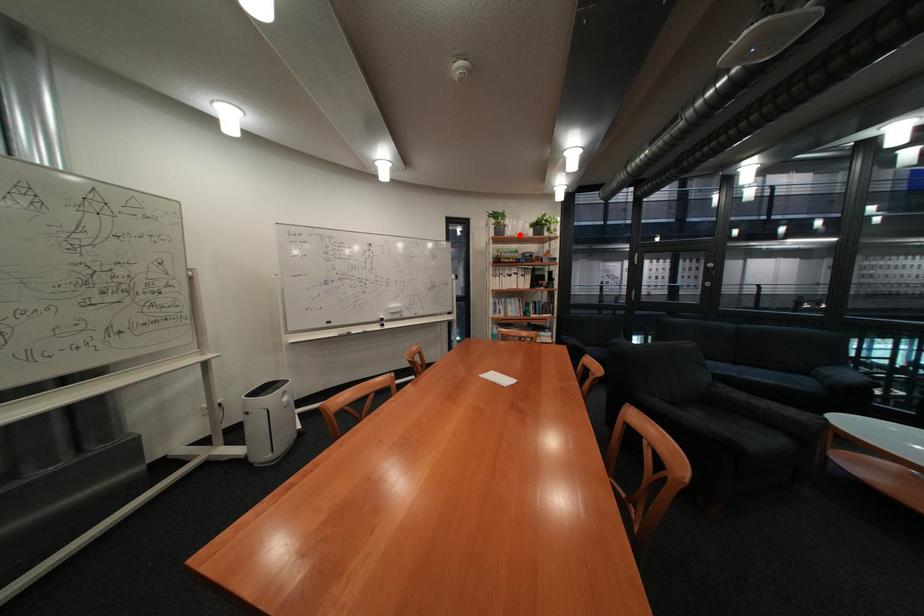
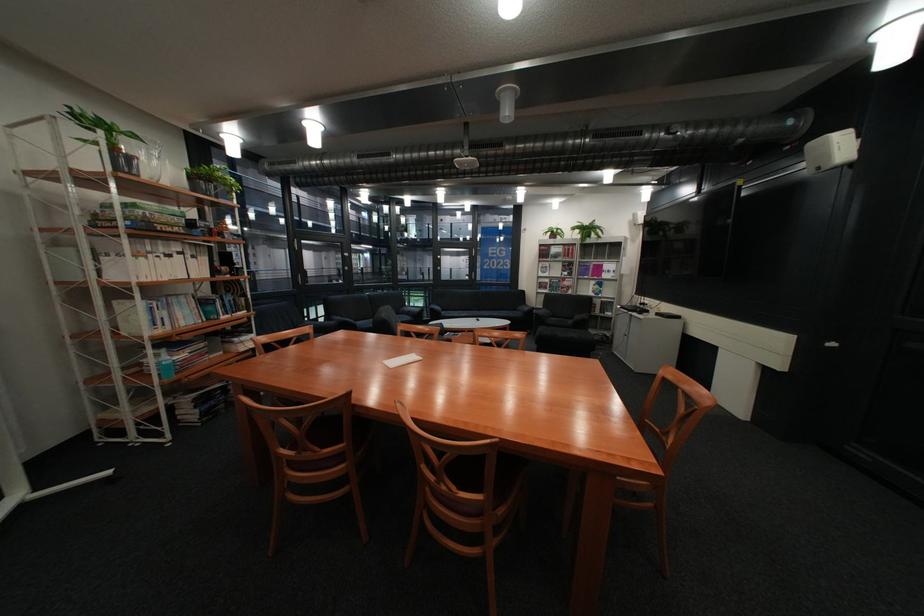
Where in the second image is the point corresponding to the highlighted location from the first image?

(152, 177)